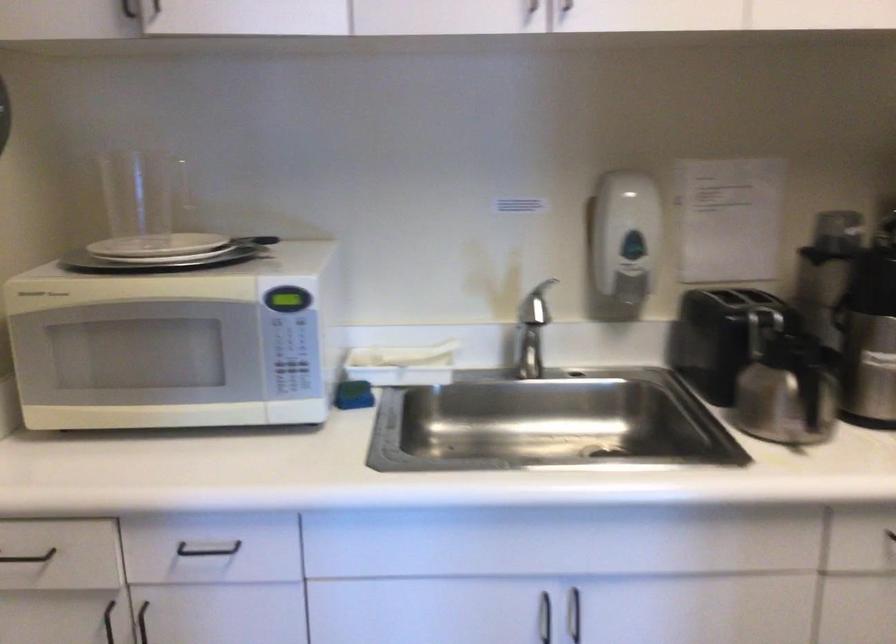
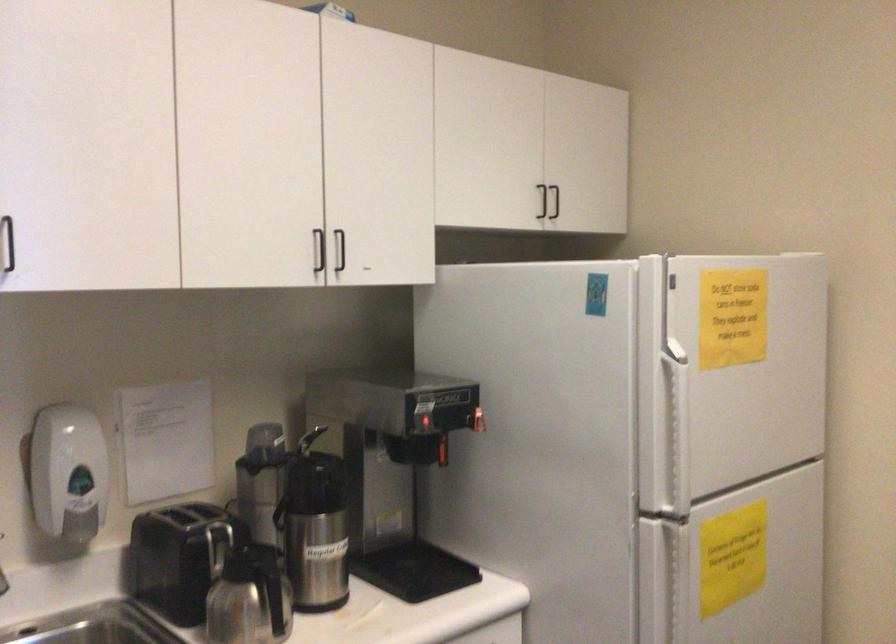
Locate, in the second image, the point that corresponds to [782,384] in the first image.

(251, 599)